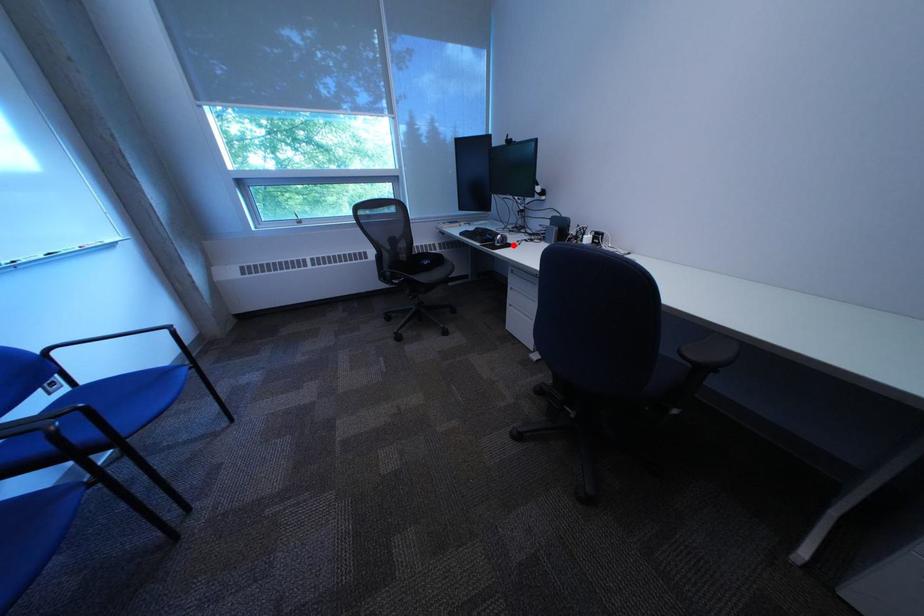
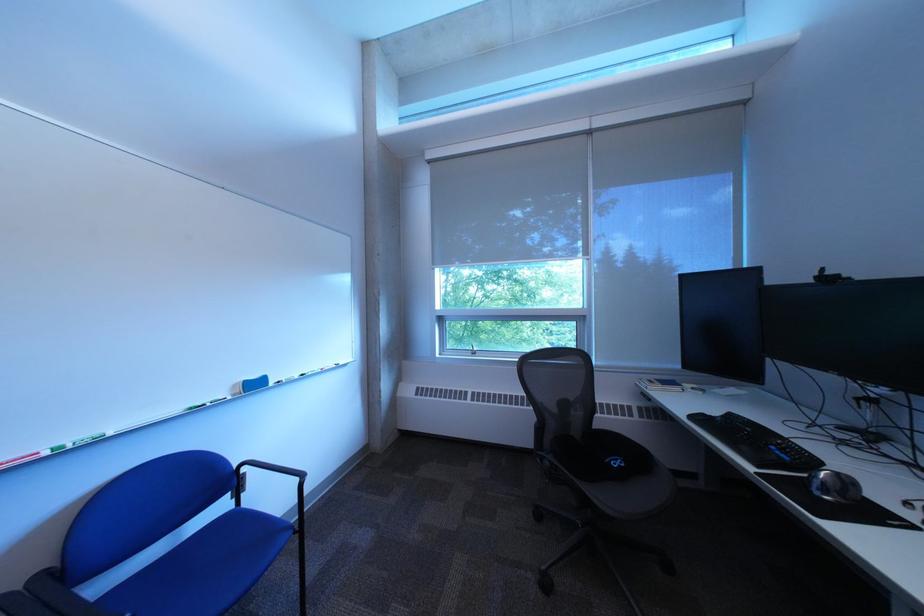
Question: I am providing you with two images of the same scene from different viewpoints. Image1 has a red point marked. In image2, the corresponding 3D location appears at what relative position? Reply with the corresponding letter.

Choices:
 (A) Closer
 (B) Farther

Answer: (B)